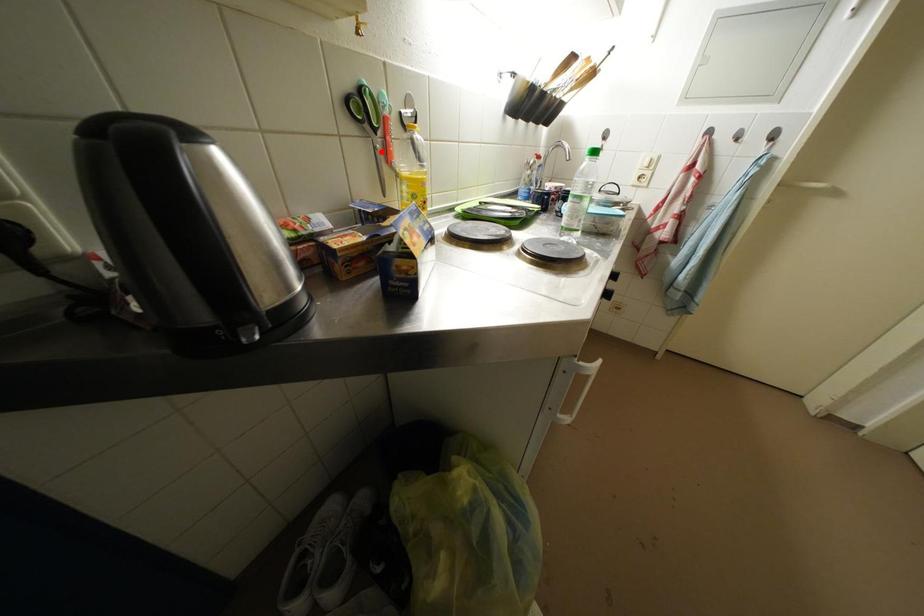
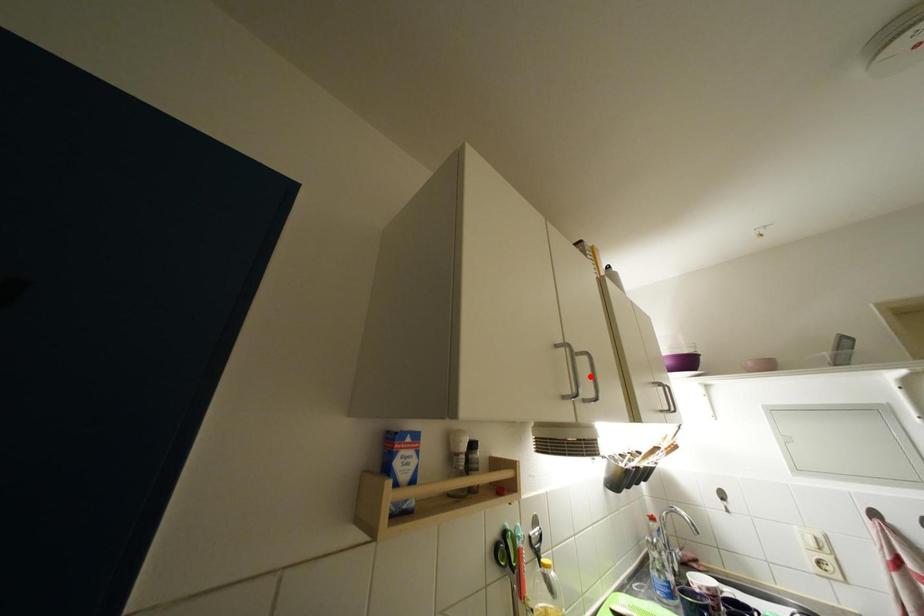
I am providing you with two images of the same scene from different viewpoints. A red point is marked on the first image and another point is marked on the second image. Are the points marked in image1 and image2 representing the same 3D position?

No